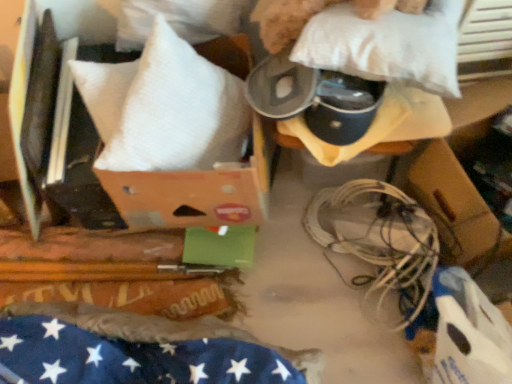
Question: Is white soft pillow at upper left, the first pillow positioned from the left, positioned far away from white matte wires at lower right?

Choices:
 (A) yes
 (B) no

Answer: (B)

Question: From the image's perspective, is white soft pillow at upper left, the first pillow positioned from the left, on top of white matte wires at lower right?

Choices:
 (A) yes
 (B) no

Answer: (A)

Question: Does white soft pillow at upper left, the 2th pillow in the right-to-left sequence, have a greater height compared to white matte wires at lower right?

Choices:
 (A) no
 (B) yes

Answer: (B)

Question: Is white soft pillow at upper left, the 2th pillow in the right-to-left sequence, outside of white matte wires at lower right?

Choices:
 (A) yes
 (B) no

Answer: (A)

Question: Would you say white soft pillow at upper left, the 2th pillow in the right-to-left sequence, contains white matte wires at lower right?

Choices:
 (A) no
 (B) yes

Answer: (A)

Question: Is point (113, 147) closer or farther from the camera than point (423, 51)?

Choices:
 (A) farther
 (B) closer

Answer: (A)

Question: From a real-world perspective, is white soft pillow at upper left, the first pillow positioned from the left, positioned above or below white soft pillow at upper center, which is the 2th pillow from left to right?

Choices:
 (A) below
 (B) above

Answer: (A)

Question: Looking at the image, does white soft pillow at upper left, the 2th pillow in the right-to-left sequence, seem bigger or smaller compared to white soft pillow at upper center, arranged as the first pillow when viewed from the right?

Choices:
 (A) small
 (B) big

Answer: (B)

Question: Is white soft pillow at upper left, the first pillow positioned from the left, inside the boundaries of white soft pillow at upper center, which is the 2th pillow from left to right, or outside?

Choices:
 (A) outside
 (B) inside

Answer: (A)

Question: Which is correct: white soft pillow at upper left, the first pillow positioned from the left, is inside white matte wires at lower right, or outside of it?

Choices:
 (A) inside
 (B) outside

Answer: (B)

Question: Considering the positions of point (134, 132) and point (399, 274), is point (134, 132) closer or farther from the camera than point (399, 274)?

Choices:
 (A) closer
 (B) farther

Answer: (A)

Question: Considering the positions of white soft pillow at upper left, the 2th pillow in the right-to-left sequence, and white matte wires at lower right in the image, is white soft pillow at upper left, the 2th pillow in the right-to-left sequence, wider or thinner than white matte wires at lower right?

Choices:
 (A) thin
 (B) wide

Answer: (B)

Question: From the image's perspective, is white soft pillow at upper left, the first pillow positioned from the left, above or below white matte wires at lower right?

Choices:
 (A) below
 (B) above

Answer: (B)

Question: From a real-world perspective, is white soft pillow at upper center, which is the 2th pillow from left to right, physically located above or below white soft pillow at upper left, the first pillow positioned from the left?

Choices:
 (A) below
 (B) above

Answer: (B)

Question: From the image's perspective, relative to white soft pillow at upper left, the 2th pillow in the right-to-left sequence, is white soft pillow at upper center, arranged as the first pillow when viewed from the right, above or below?

Choices:
 (A) below
 (B) above

Answer: (B)